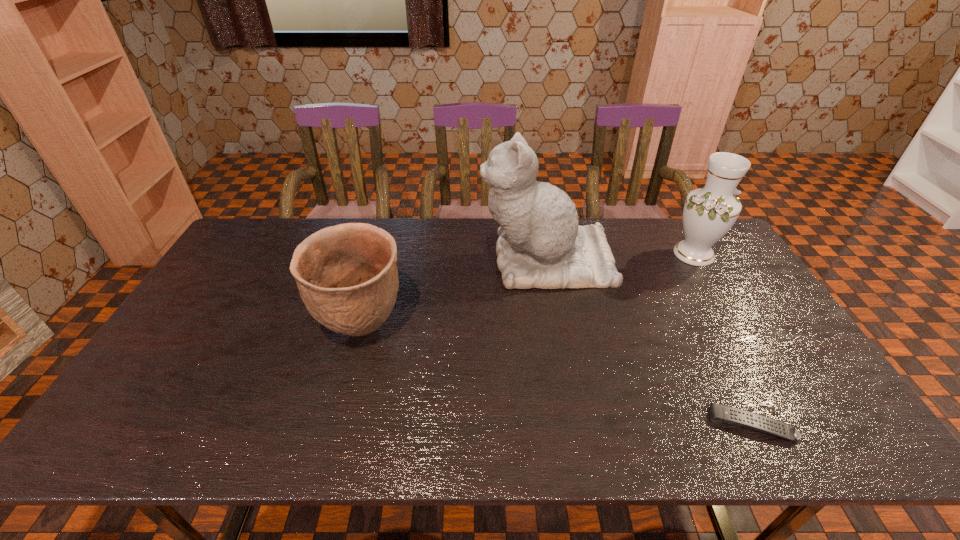
Locate an element on the screen. The height and width of the screenshot is (540, 960). free space that satisfies the following two spatial constraints: 1. on the front-facing side of the third object from right to left; 2. on the left side of the remote control is located at coordinates (577, 424).